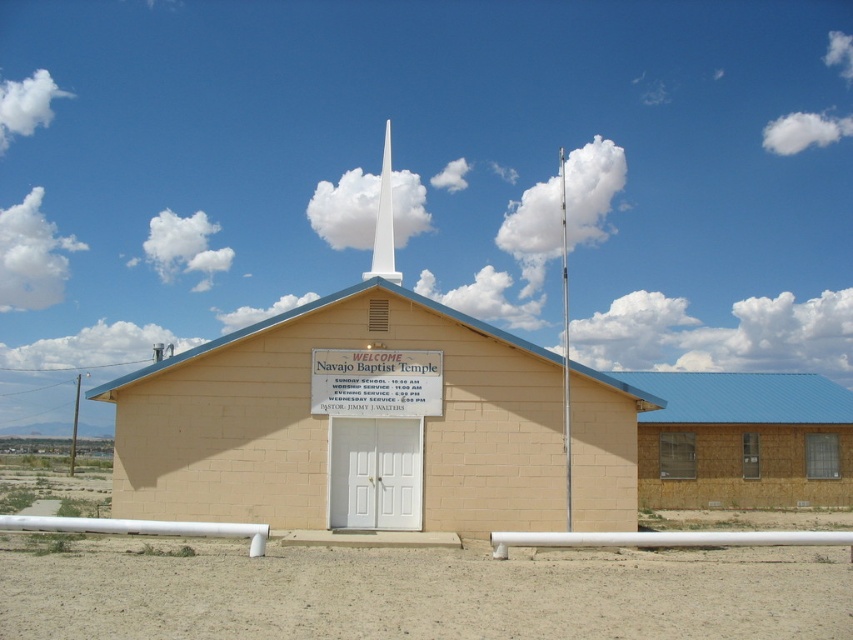
Can you confirm if beige brick chapel at center is taller than white smooth spire at center?

No, beige brick chapel at center is not taller than white smooth spire at center.

Which is below, beige brick chapel at center or white smooth spire at center?

Positioned lower is beige brick chapel at center.

You are a GUI agent. You are given a task and a screenshot of the screen. Output one action in this format:
    pyautogui.click(x=<x>, y=<y>)
    Task: Click on the beige brick chapel at center
    Image resolution: width=853 pixels, height=640 pixels.
    Given the screenshot: What is the action you would take?
    pyautogui.click(x=375, y=429)

This screenshot has width=853, height=640. Find the location of `white wooden sign at center`. white wooden sign at center is located at coordinates (376, 381).

Who is more forward, (405, 353) or (379, 208)?

Point (405, 353) is more forward.

Where is `white wooden sign at center`? white wooden sign at center is located at coordinates (376, 381).

Can you confirm if beige brick chapel at center is wider than white wooden sign at center?

Yes.

Is point (468, 449) positioned in front of point (405, 372)?

Yes, point (468, 449) is in front of point (405, 372).

Identify the location of beige brick chapel at center. The image size is (853, 640). (375, 429).